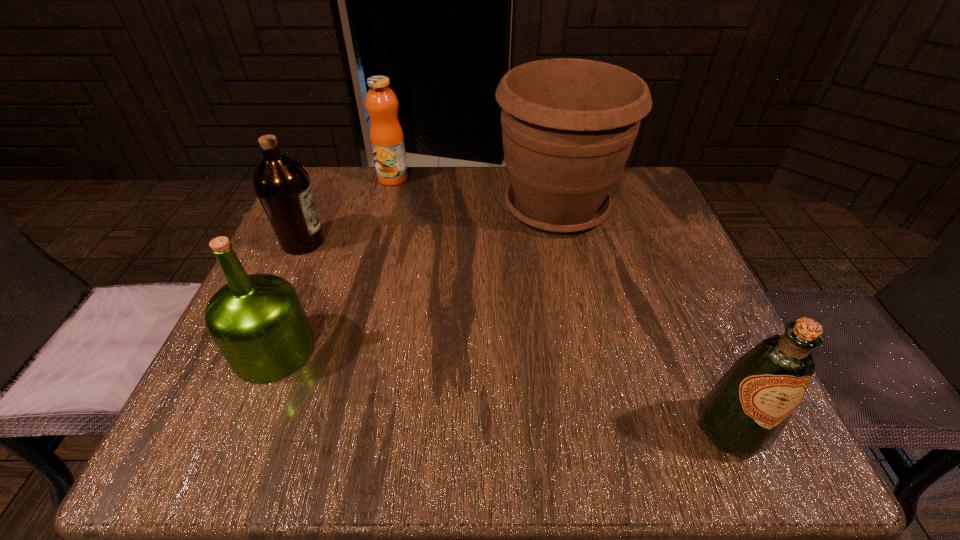
Find the location of a particular element. This screenshot has width=960, height=540. unoccupied position between the third object from left to right and the nearest object is located at coordinates (562, 303).

The width and height of the screenshot is (960, 540). Find the location of `vacant region between the nearest object and the farthest olive oil`. vacant region between the nearest object and the farthest olive oil is located at coordinates (516, 335).

Image resolution: width=960 pixels, height=540 pixels. I want to click on free spot between the nearest object and the farthest olive oil, so click(x=516, y=335).

Locate an element on the screen. This screenshot has width=960, height=540. free point between the nearest olive oil and the farthest olive oil is located at coordinates (516, 335).

Choose which object is the third nearest neighbor to the second farthest olive oil. Please provide its 2D coordinates. Your answer should be formatted as a tuple, i.e. [(x, y)], where the tuple contains the x and y coordinates of a point satisfying the conditions above.

[(386, 135)]

Select which object is the closest to the fourth farthest object. Please provide its 2D coordinates. Your answer should be formatted as a tuple, i.e. [(x, y)], where the tuple contains the x and y coordinates of a point satisfying the conditions above.

[(283, 186)]

Image resolution: width=960 pixels, height=540 pixels. Identify the location of olive oil that is the third closest to the fruit juice. (744, 413).

Choose which olive oil is the nearest neighbor to the farthest olive oil. Please provide its 2D coordinates. Your answer should be formatted as a tuple, i.e. [(x, y)], where the tuple contains the x and y coordinates of a point satisfying the conditions above.

[(257, 321)]

The height and width of the screenshot is (540, 960). What are the coordinates of `vacant region that satisfies the following two spatial constraints: 1. on the label of the second farthest olive oil; 2. on the right side of the farthest olive oil` in the screenshot? It's located at 254,350.

The image size is (960, 540). What are the coordinates of `vacant point that satisfies the following two spatial constraints: 1. on the front side of the flowerpot; 2. on the left side of the third object from left to right` in the screenshot? It's located at (385, 208).